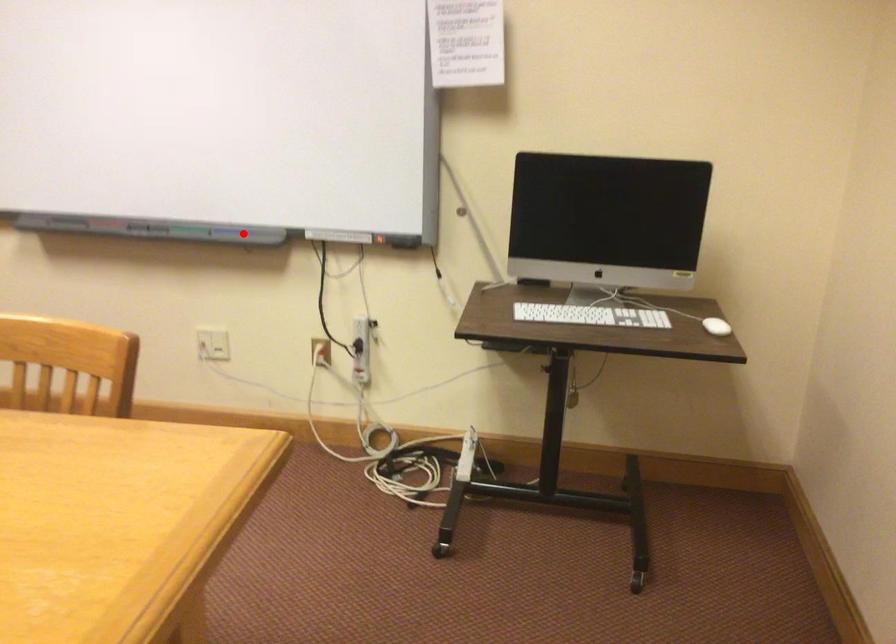
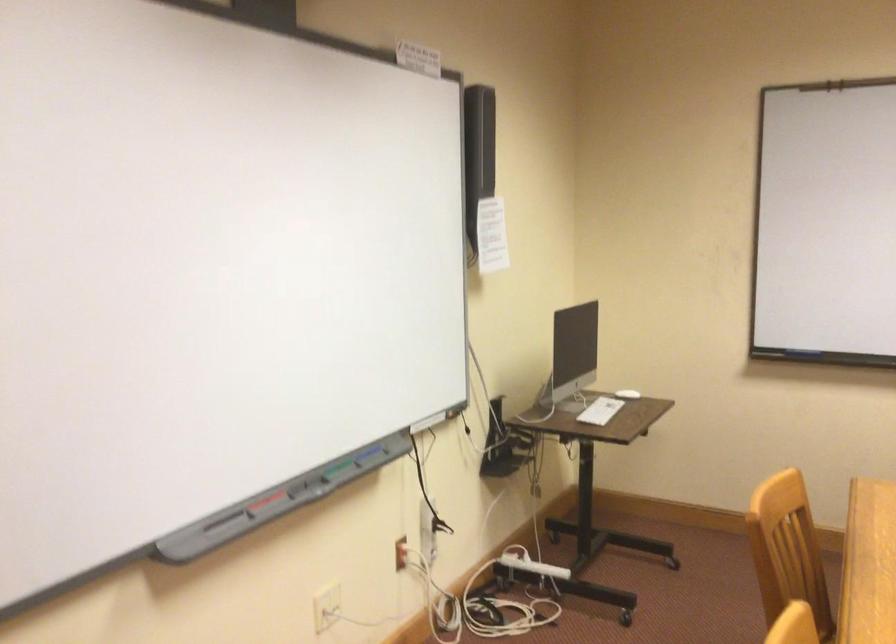
The point at the highlighted location is marked in the first image. Where is the corresponding point in the second image?

(368, 453)